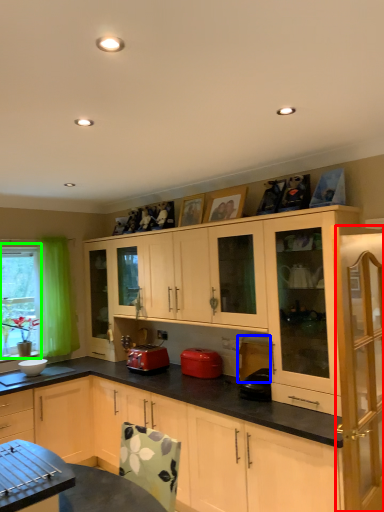
Question: Based on their relative distances, which object is farther from cabinetry (highlighted by a red box)? Choose from appliance (highlighted by a blue box) and bay window (highlighted by a green box).

Choices:
 (A) appliance
 (B) bay window

Answer: (B)